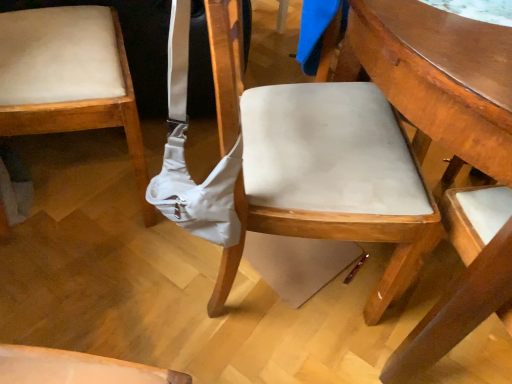
The height and width of the screenshot is (384, 512). I want to click on matte beige cushion at left, which is the 1th chair from left to right, so click(x=69, y=79).

In order to click on wooden table at center in this screenshot , I will do `click(438, 77)`.

Does white fabric shoulder bag at center have a lesser width compared to wooden table at center?

Indeed, white fabric shoulder bag at center has a lesser width compared to wooden table at center.

Considering the sizes of white fabric shoulder bag at center and wooden table at center in the image, is white fabric shoulder bag at center taller or shorter than wooden table at center?

In the image, white fabric shoulder bag at center appears to be shorter than wooden table at center.

Is white fabric shoulder bag at center oriented towards wooden table at center?

Yes, white fabric shoulder bag at center is facing wooden table at center.

Considering the sizes of objects white fabric shoulder bag at center and wooden table at center in the image provided, who is smaller, white fabric shoulder bag at center or wooden table at center?

white fabric shoulder bag at center is smaller.

Is point (379, 234) closer or farther from the camera than point (471, 130)?

Point (379, 234) appears to be farther away from the viewer than point (471, 130).

From a real-world perspective, relative to wooden table at center, is matte white chair at center, the 2th chair viewed from the left, vertically above or below?

In terms of real-world spatial position, matte white chair at center, the 2th chair viewed from the left, is above wooden table at center.

Starting from the wooden table at center, which chair is the 1st one behind? Please provide its 2D coordinates.

[(337, 239)]

Is matte white chair at center, which is the first chair from right to left, at the right side of wooden table at center?

In fact, matte white chair at center, which is the first chair from right to left, is to the left of wooden table at center.

Between matte beige cushion at left, the 2th chair when ordered from right to left, and white fabric shoulder bag at center, which one has smaller size?

white fabric shoulder bag at center.

In the scene shown: Is matte beige cushion at left, the 2th chair when ordered from right to left, oriented towards white fabric shoulder bag at center?

No, matte beige cushion at left, the 2th chair when ordered from right to left, is not aimed at white fabric shoulder bag at center.

Would you consider matte beige cushion at left, the 2th chair when ordered from right to left, to be distant from white fabric shoulder bag at center?

No, matte beige cushion at left, the 2th chair when ordered from right to left, is in close proximity to white fabric shoulder bag at center.

Considering the sizes of objects matte beige cushion at left, which is the 1th chair from left to right, and white fabric shoulder bag at center in the image provided, who is taller, matte beige cushion at left, which is the 1th chair from left to right, or white fabric shoulder bag at center?

matte beige cushion at left, which is the 1th chair from left to right, is taller.

Image resolution: width=512 pixels, height=384 pixels. What are the coordinates of `chair on the right side of white fabric shoulder bag at center` in the screenshot? It's located at (337, 239).

Is matte white chair at center, the 2th chair viewed from the left, completely or partially outside of white fabric shoulder bag at center?

That's correct, matte white chair at center, the 2th chair viewed from the left, is outside of white fabric shoulder bag at center.

Is point (383, 313) closer or farther from the camera than point (229, 193)?

Point (383, 313) appears to be farther away from the viewer than point (229, 193).

Considering the relative sizes of white fabric shoulder bag at center and matte white chair at center, the 2th chair viewed from the left, in the image provided, is white fabric shoulder bag at center thinner than matte white chair at center, the 2th chair viewed from the left,?

Yes, white fabric shoulder bag at center is thinner than matte white chair at center, the 2th chair viewed from the left.

Considering the sizes of white fabric shoulder bag at center and matte white chair at center, the 2th chair viewed from the left, in the image, is white fabric shoulder bag at center bigger or smaller than matte white chair at center, the 2th chair viewed from the left,?

In the image, white fabric shoulder bag at center appears to be smaller than matte white chair at center, the 2th chair viewed from the left.

Does white fabric shoulder bag at center turn towards matte white chair at center, the 2th chair viewed from the left?

Yes, white fabric shoulder bag at center is turned towards matte white chair at center, the 2th chair viewed from the left.

From a real-world perspective, is white fabric shoulder bag at center above or below matte white chair at center, which is the first chair from right to left?

Clearly, from a real-world perspective, white fabric shoulder bag at center is above matte white chair at center, which is the first chair from right to left.

Image resolution: width=512 pixels, height=384 pixels. Find the location of `shoulder bag in front of the matte beige cushion at left, which is the 1th chair from left to right`. shoulder bag in front of the matte beige cushion at left, which is the 1th chair from left to right is located at coordinates (184, 158).

Is white fabric shoulder bag at center next to matte beige cushion at left, which is the 1th chair from left to right, and touching it?

No, white fabric shoulder bag at center is not next to matte beige cushion at left, which is the 1th chair from left to right.

Can you confirm if white fabric shoulder bag at center is bigger than matte beige cushion at left, which is the 1th chair from left to right?

Actually, white fabric shoulder bag at center might be smaller than matte beige cushion at left, which is the 1th chair from left to right.

From the image's perspective, is white fabric shoulder bag at center under matte beige cushion at left, the 2th chair when ordered from right to left?

Indeed, from the image's perspective, white fabric shoulder bag at center is shown beneath matte beige cushion at left, the 2th chair when ordered from right to left.

Considering the sizes of objects wooden table at center and matte beige cushion at left, which is the 1th chair from left to right, in the image provided, who is taller, wooden table at center or matte beige cushion at left, which is the 1th chair from left to right,?

With more height is wooden table at center.

Identify the location of chair that is the 2nd object located above the wooden table at center (from the image's perspective). (69, 79).

In terms of width, does wooden table at center look wider or thinner when compared to matte beige cushion at left, which is the 1th chair from left to right?

wooden table at center is wider than matte beige cushion at left, which is the 1th chair from left to right.

Find the location of a particular element. The width and height of the screenshot is (512, 384). shoulder bag behind the wooden table at center is located at coordinates (184, 158).

Which chair is the 1st one when counting from the left side of the wooden table at center? Please provide its 2D coordinates.

[(337, 239)]

Looking at this image, based on their spatial positions, is matte white chair at center, which is the first chair from right to left, or wooden table at center further from matte beige cushion at left, which is the 1th chair from left to right?

wooden table at center is positioned further to the anchor matte beige cushion at left, which is the 1th chair from left to right.

When comparing their distances from matte white chair at center, which is the first chair from right to left, does wooden table at center or matte beige cushion at left, the 2th chair when ordered from right to left, seem further?

Based on the image, matte beige cushion at left, the 2th chair when ordered from right to left, appears to be further to matte white chair at center, which is the first chair from right to left.

Considering their positions, is wooden table at center positioned further to white fabric shoulder bag at center than matte white chair at center, which is the first chair from right to left?

Based on the image, wooden table at center appears to be further to white fabric shoulder bag at center.

From the image, which object appears to be nearer to wooden table at center, matte white chair at center, which is the first chair from right to left, or matte beige cushion at left, the 2th chair when ordered from right to left?

matte white chair at center, which is the first chair from right to left, is closer to wooden table at center.

Estimate the real-world distances between objects in this image. Which object is further from wooden table at center, matte beige cushion at left, the 2th chair when ordered from right to left, or white fabric shoulder bag at center?

matte beige cushion at left, the 2th chair when ordered from right to left, is positioned further to the anchor wooden table at center.

Based on their spatial positions, is wooden table at center or matte beige cushion at left, which is the 1th chair from left to right, further from white fabric shoulder bag at center?

wooden table at center is positioned further to the anchor white fabric shoulder bag at center.

Estimate the real-world distances between objects in this image. Which object is further from matte beige cushion at left, the 2th chair when ordered from right to left, wooden table at center or matte white chair at center, which is the first chair from right to left?

The object further to matte beige cushion at left, the 2th chair when ordered from right to left, is wooden table at center.

Considering their positions, is matte beige cushion at left, the 2th chair when ordered from right to left, positioned further to matte white chair at center, which is the first chair from right to left, than wooden table at center?

matte beige cushion at left, the 2th chair when ordered from right to left, is further to matte white chair at center, which is the first chair from right to left.

At what (x,y) coordinates should I click in order to perform the action: click on shoulder bag situated between matte beige cushion at left, the 2th chair when ordered from right to left, and wooden table at center from left to right. Please return your answer as a coordinate pair (x, y). This screenshot has width=512, height=384. Looking at the image, I should click on click(184, 158).

This screenshot has height=384, width=512. I want to click on shoulder bag between matte beige cushion at left, the 2th chair when ordered from right to left, and matte white chair at center, which is the first chair from right to left, so click(x=184, y=158).

Locate an element on the screen. The image size is (512, 384). chair between white fabric shoulder bag at center and wooden table at center from left to right is located at coordinates (337, 239).

Locate an element on the screen. The image size is (512, 384). chair between matte beige cushion at left, the 2th chair when ordered from right to left, and wooden table at center, in the horizontal direction is located at coordinates (337, 239).